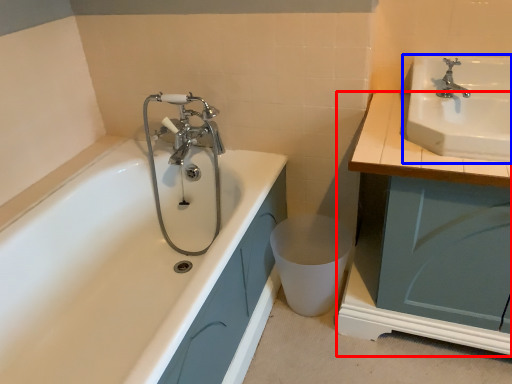
Question: Which object is closer to the camera taking this photo, cabinetry (highlighted by a red box) or sink (highlighted by a blue box)?

Choices:
 (A) cabinetry
 (B) sink

Answer: (A)